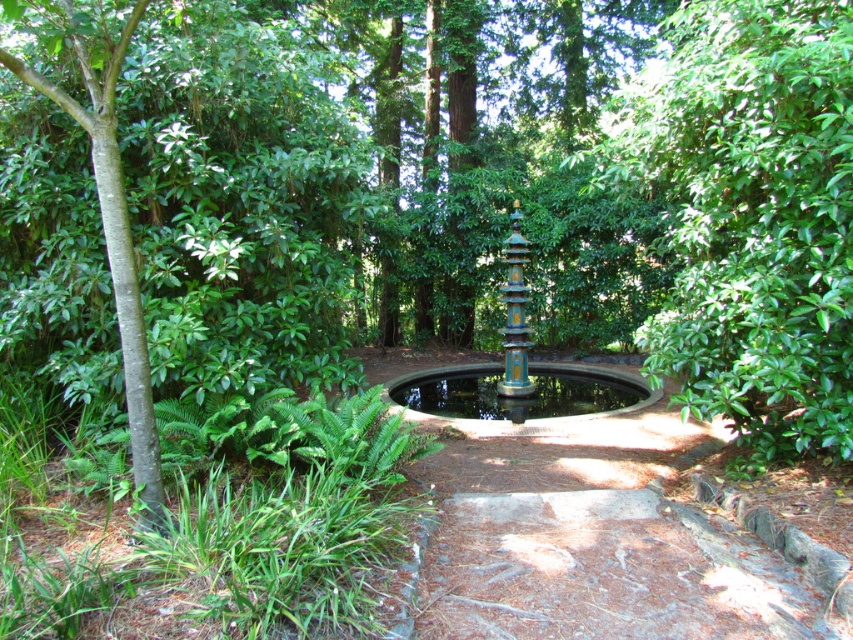
Question: Is green leafy tree at center bigger than green smooth bark tree at left?

Choices:
 (A) no
 (B) yes

Answer: (B)

Question: Does multicolored painted fountain at center lie in front of green smooth bark tree at left?

Choices:
 (A) yes
 (B) no

Answer: (B)

Question: Which point is farther to the camera?

Choices:
 (A) (846, 84)
 (B) (492, 388)
 (C) (135, 336)

Answer: (B)

Question: Based on their relative distances, which object is nearer to the blue painted metal fountain at center?

Choices:
 (A) green smooth bark tree at left
 (B) green leafy tree at center

Answer: (B)

Question: Which of the following is the farthest from the observer?

Choices:
 (A) (695, 403)
 (B) (589, 417)
 (C) (115, 182)
 (D) (477, 408)

Answer: (D)

Question: In this image, where is multicolored painted fountain at center located relative to green smooth bark tree at left?

Choices:
 (A) below
 (B) above

Answer: (B)